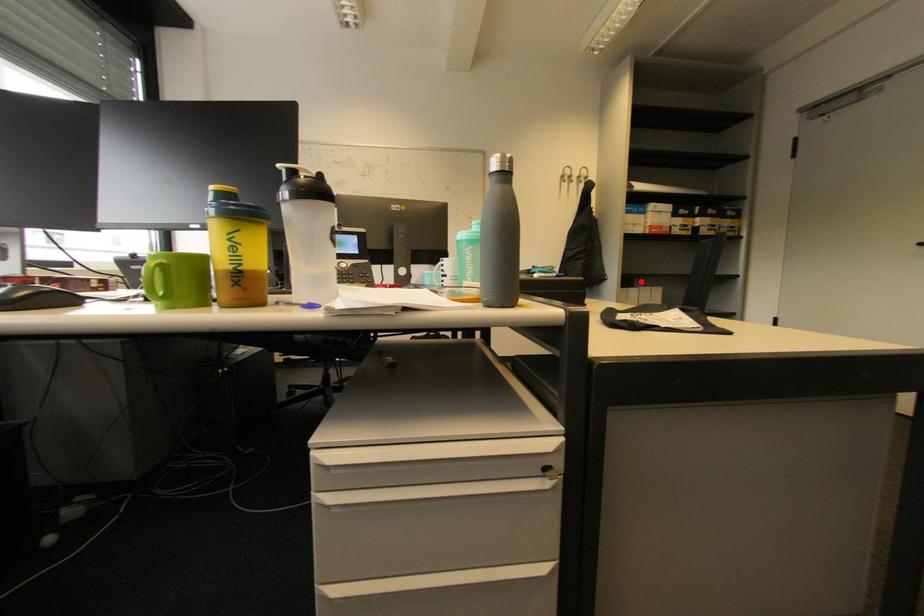
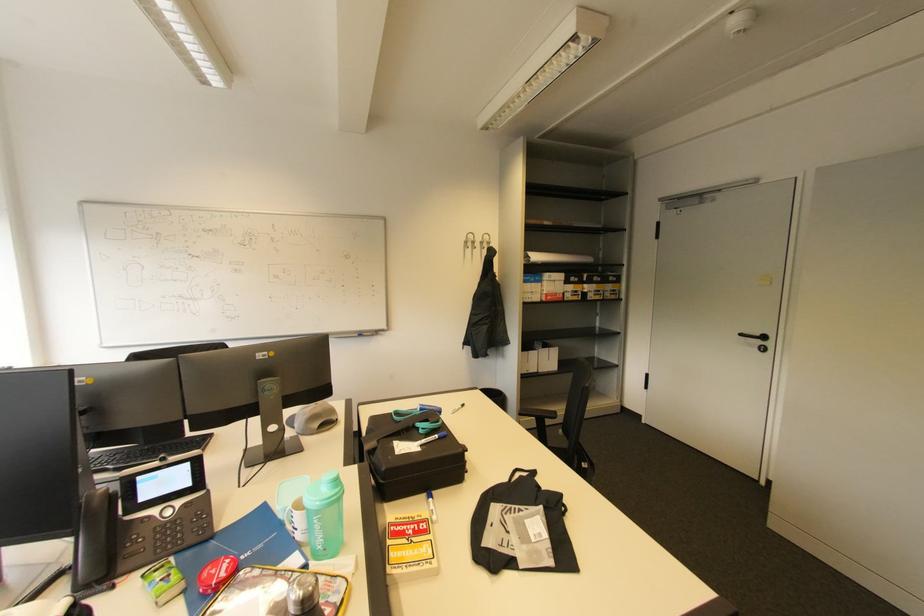
Question: I am providing you with two images of the same scene from different viewpoints. A red point is shown in image1. For the corresponding object point in image2, is it positioned nearer or farther from the camera?

Choices:
 (A) Nearer
 (B) Farther

Answer: (B)